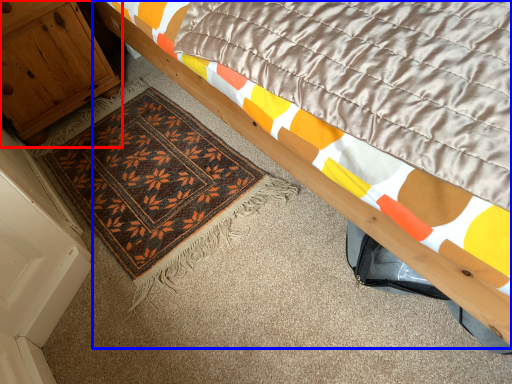
Question: Which object appears closest to the camera in this image, cabinetry (highlighted by a red box) or bed (highlighted by a blue box)?

Choices:
 (A) cabinetry
 (B) bed

Answer: (B)